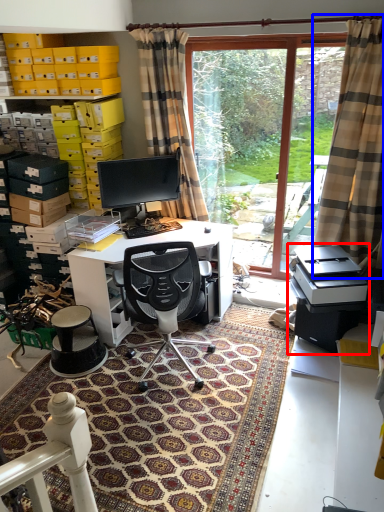
Question: Which object appears closest to the camera in this image, printer (highlighted by a red box) or curtain (highlighted by a blue box)?

Choices:
 (A) printer
 (B) curtain

Answer: (B)